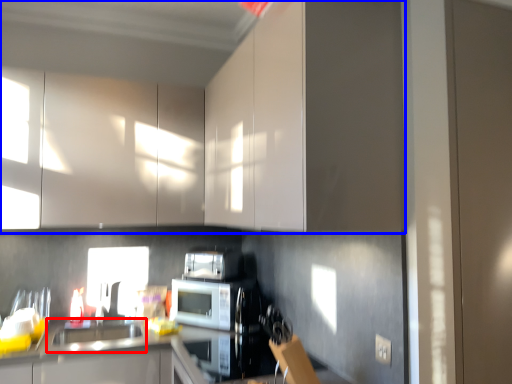
Question: Which object is further to the camera taking this photo, sink (highlighted by a red box) or cabinetry (highlighted by a blue box)?

Choices:
 (A) sink
 (B) cabinetry

Answer: (A)